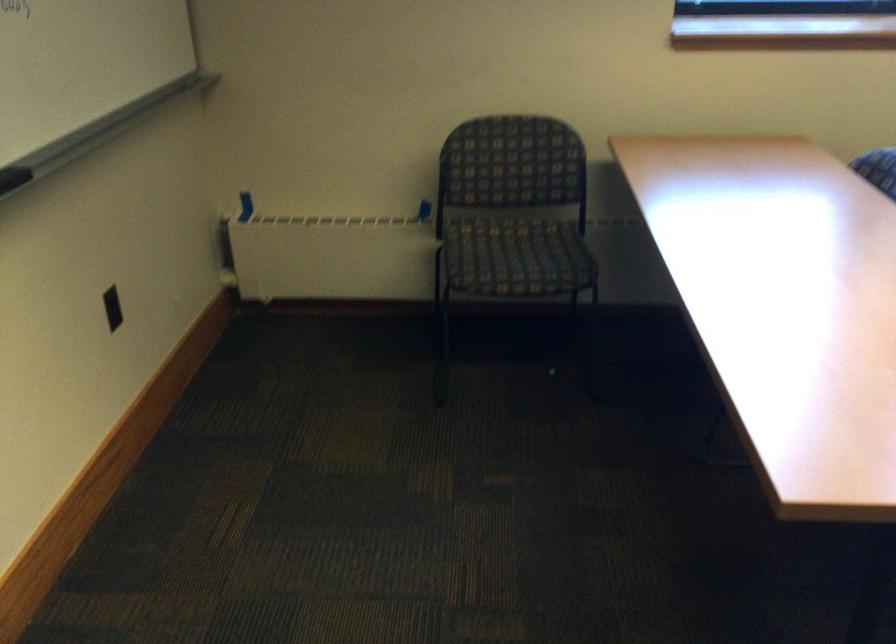
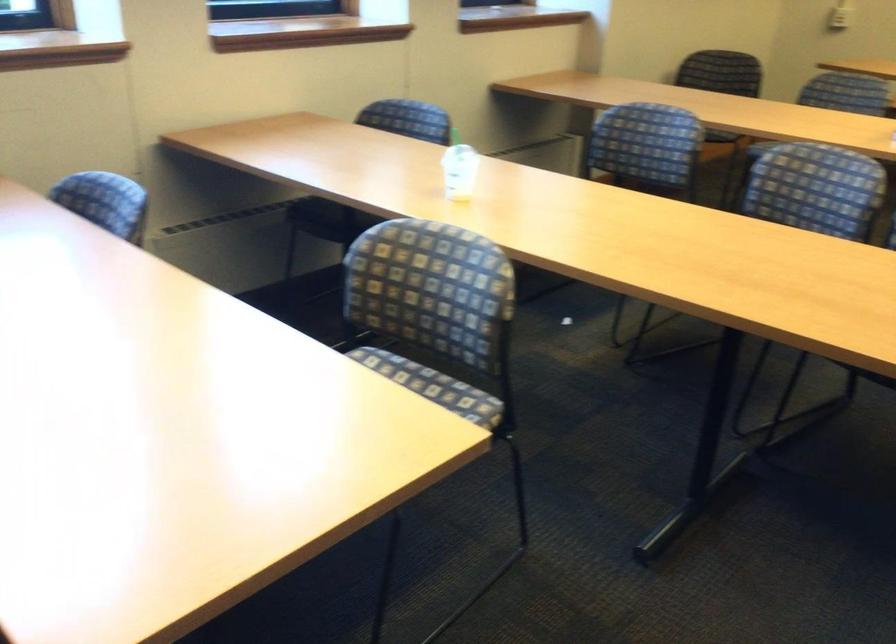
Question: The images are taken continuously from a first-person perspective. In which direction is your viewpoint rotating?

Choices:
 (A) Left
 (B) Right
 (C) Up
 (D) Down

Answer: (B)